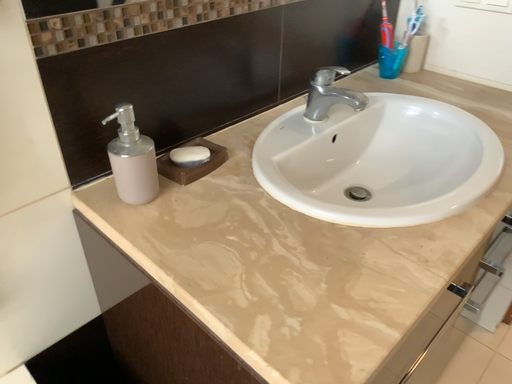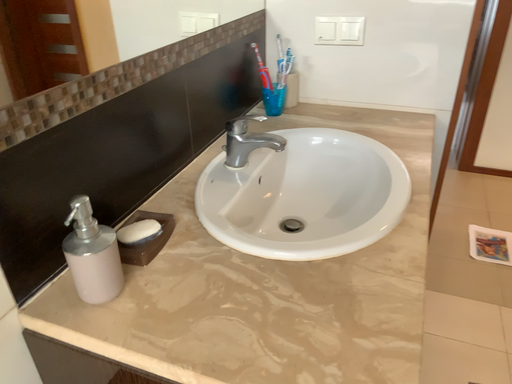
Question: How did the camera likely rotate when shooting the video?

Choices:
 (A) rotated left
 (B) rotated right

Answer: (B)